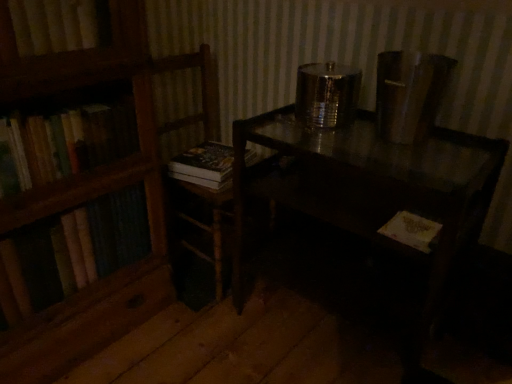
Question: From the image's perspective, is shiny dark wood table at center located above wooden chair at left?

Choices:
 (A) no
 (B) yes

Answer: (A)

Question: Is shiny dark wood table at center taller than wooden chair at left?

Choices:
 (A) yes
 (B) no

Answer: (B)

Question: Does shiny dark wood table at center touch wooden chair at left?

Choices:
 (A) no
 (B) yes

Answer: (A)

Question: Is shiny dark wood table at center smaller than wooden chair at left?

Choices:
 (A) no
 (B) yes

Answer: (A)

Question: Does shiny dark wood table at center turn towards wooden chair at left?

Choices:
 (A) yes
 (B) no

Answer: (B)

Question: In terms of height, does hardcover book at center, the 1th book when ordered from top to bottom, look taller or shorter compared to wooden chair at left?

Choices:
 (A) tall
 (B) short

Answer: (B)

Question: Is hardcover book at center, which is counted as the 2th book, starting from the bottom, in front of or behind wooden chair at left in the image?

Choices:
 (A) front
 (B) behind

Answer: (B)

Question: Looking at the image, does hardcover book at center, the 1th book when ordered from top to bottom, seem bigger or smaller compared to wooden chair at left?

Choices:
 (A) big
 (B) small

Answer: (B)

Question: Is point (197, 163) closer or farther from the camera than point (221, 286)?

Choices:
 (A) farther
 (B) closer

Answer: (B)

Question: Considering the positions of yellow paper book at lower right, the second book positioned from the left, and shiny dark wood table at center in the image, is yellow paper book at lower right, the second book positioned from the left, taller or shorter than shiny dark wood table at center?

Choices:
 (A) tall
 (B) short

Answer: (B)

Question: Considering the positions of yellow paper book at lower right, the second book positioned from the left, and shiny dark wood table at center in the image, is yellow paper book at lower right, the second book positioned from the left, bigger or smaller than shiny dark wood table at center?

Choices:
 (A) small
 (B) big

Answer: (A)

Question: From a real-world perspective, is yellow paper book at lower right, acting as the 2th book starting from the back, above or below shiny dark wood table at center?

Choices:
 (A) below
 (B) above

Answer: (B)

Question: Is point (420, 218) closer or farther from the camera than point (439, 135)?

Choices:
 (A) farther
 (B) closer

Answer: (B)

Question: Considering the positions of shiny dark wood table at center and wooden chair at left in the image, is shiny dark wood table at center bigger or smaller than wooden chair at left?

Choices:
 (A) big
 (B) small

Answer: (A)

Question: From the image's perspective, is shiny dark wood table at center located above or below wooden chair at left?

Choices:
 (A) above
 (B) below

Answer: (B)